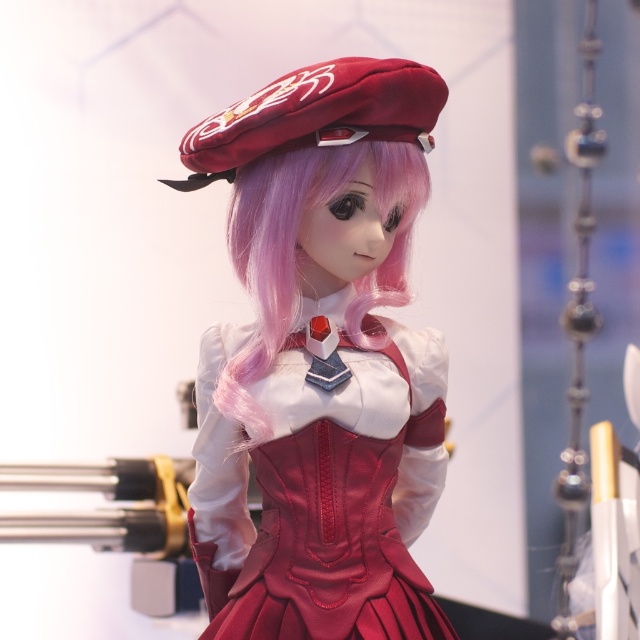
Consider the image. Measure the distance between point (225, 540) and camera.

Point (225, 540) and camera are 4.29 feet apart.

From the picture: Does matte velvet beret at center come in front of satin red beret at upper center?

No, matte velvet beret at center is further to the viewer.

Where is `matte velvet beret at center`? The width and height of the screenshot is (640, 640). matte velvet beret at center is located at coordinates (320, 360).

You are a GUI agent. You are given a task and a screenshot of the screen. Output one action in this format:
    pyautogui.click(x=<x>, y=<y>)
    Task: Click on the matte velvet beret at center
    
    Given the screenshot: What is the action you would take?
    pyautogui.click(x=320, y=360)

Does matte velvet beret at center have a larger size compared to pink silky hair at center?

Correct, matte velvet beret at center is larger in size than pink silky hair at center.

Identify the location of matte velvet beret at center. Image resolution: width=640 pixels, height=640 pixels. (320, 360).

Consider the image. Can you confirm if pink silky hair at center is wider than satin red beret at upper center?

Incorrect, pink silky hair at center's width does not surpass satin red beret at upper center's.

Which is more to the right, pink silky hair at center or satin red beret at upper center?

pink silky hair at center is more to the right.

Measure the distance between pink silky hair at center and camera.

They are 3.92 feet apart.

This screenshot has width=640, height=640. In order to click on pink silky hair at center in this screenshot , I will do `click(307, 252)`.